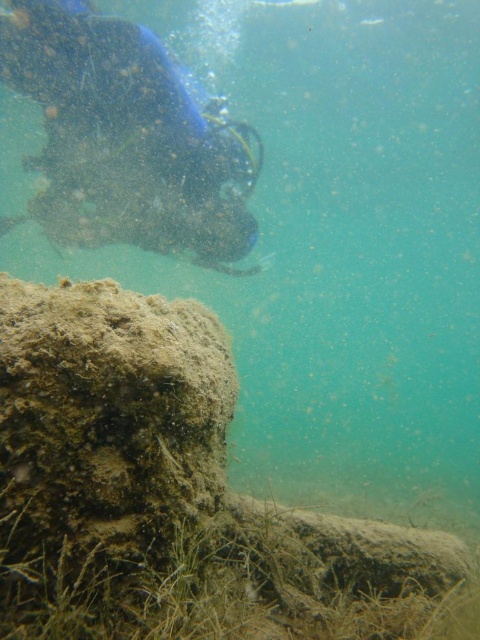
Question: Is brown mossy rock at lower left bigger than blue rubber mask at upper left?

Choices:
 (A) no
 (B) yes

Answer: (A)

Question: Which point is closer to the camera?

Choices:
 (A) (252, 164)
 (B) (99, 493)

Answer: (B)

Question: Which point is closer to the camera?

Choices:
 (A) brown mossy rock at lower left
 (B) blue rubber mask at upper left

Answer: (A)

Question: Observing the image, what is the correct spatial positioning of brown mossy rock at lower left in reference to blue rubber mask at upper left?

Choices:
 (A) right
 (B) left

Answer: (A)

Question: Among these points, which one is nearest to the camera?

Choices:
 (A) (227, 236)
 (B) (84, 582)

Answer: (B)

Question: Does brown mossy rock at lower left lie behind blue rubber mask at upper left?

Choices:
 (A) yes
 (B) no

Answer: (B)